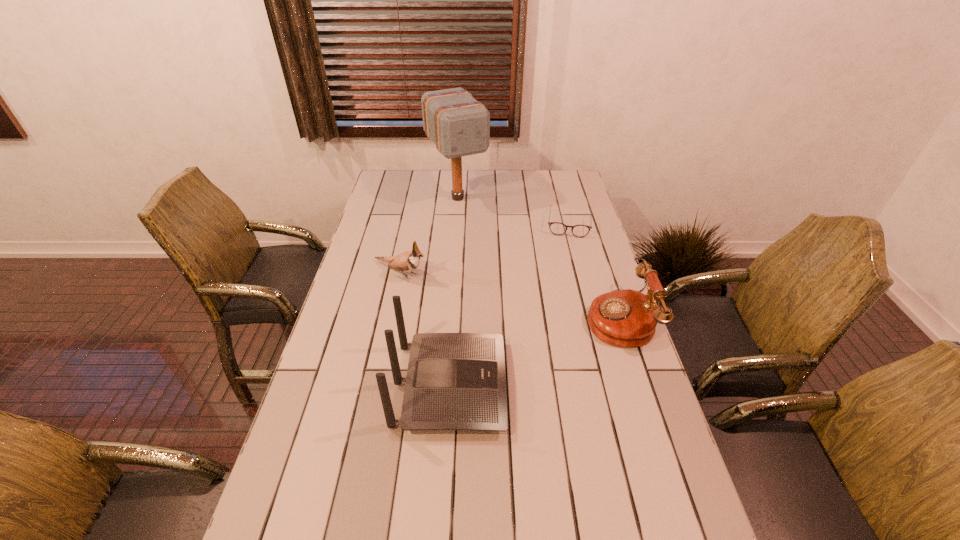
Locate an element on the screen. the fourth shortest object is located at coordinates (455, 381).

Identify the location of telephone. The height and width of the screenshot is (540, 960). (626, 318).

Find the location of a particular element. the tallest object is located at coordinates (459, 125).

Where is `bird`? bird is located at coordinates (408, 261).

Image resolution: width=960 pixels, height=540 pixels. Identify the location of the shortest object. (557, 228).

At what (x,y) coordinates should I click in order to perform the action: click on free space located on the front-facing side of the router. Please return your answer as a coordinate pair (x, y). The image size is (960, 540). Looking at the image, I should click on (562, 386).

Identify the location of free region located on the dial of the telephone. (531, 318).

Find the location of a particular element. The width and height of the screenshot is (960, 540). vacant space positioned on the dial of the telephone is located at coordinates (505, 318).

Where is `vacant area situated 0.230m on the dial of the telephone`? vacant area situated 0.230m on the dial of the telephone is located at coordinates (512, 318).

At what (x,y) coordinates should I click in order to perform the action: click on vacant region located on the striking surface of the tallest object. Please return your answer as a coordinate pair (x, y). Looking at the image, I should click on (478, 230).